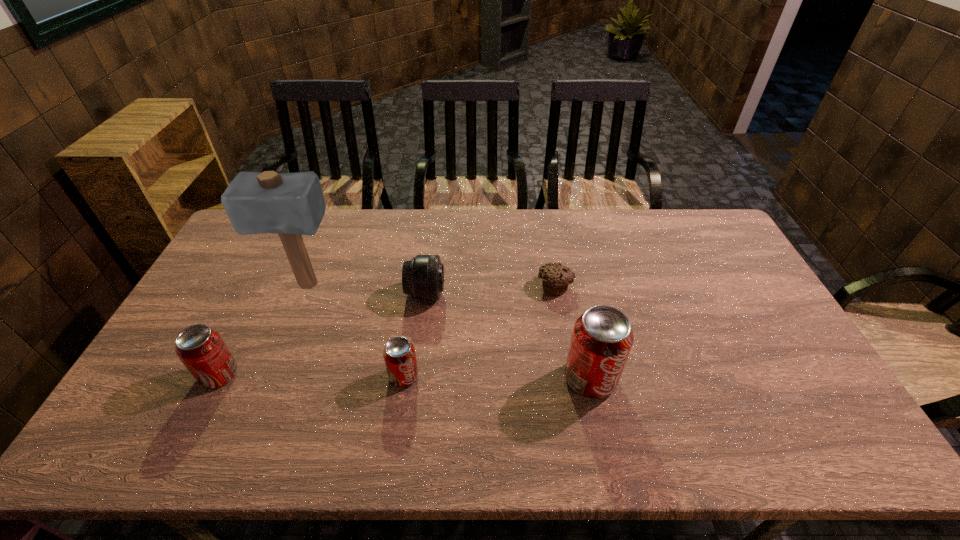
Where is `free region at the near right corner of the desktop`? free region at the near right corner of the desktop is located at coordinates (827, 414).

You are a GUI agent. You are given a task and a screenshot of the screen. Output one action in this format:
    pyautogui.click(x=<x>, y=<y>)
    Task: Click on the unoccupied area between the muffin and the shortest soda can
    The width and height of the screenshot is (960, 540).
    Given the screenshot: What is the action you would take?
    pyautogui.click(x=480, y=331)

Where is `free point between the muffin and the fifth shortest object`? free point between the muffin and the fifth shortest object is located at coordinates (572, 332).

Find the location of a particular element. The image size is (960, 540). blank region between the muffin and the telephoto lens is located at coordinates pyautogui.click(x=491, y=289).

The width and height of the screenshot is (960, 540). In order to click on free space between the telephoto lens and the leftmost soda can in this screenshot , I will do `click(323, 334)`.

The image size is (960, 540). Identify the location of empty space between the leftmost soda can and the tallest object. (263, 330).

Where is `free space that is in between the second soda can from left to right and the rightmost soda can`? This screenshot has width=960, height=540. free space that is in between the second soda can from left to right and the rightmost soda can is located at coordinates (497, 377).

Locate an element on the screen. This screenshot has height=540, width=960. free spot between the second soda can from left to right and the leftmost soda can is located at coordinates point(312,376).

Locate an element on the screen. This screenshot has width=960, height=540. empty space between the second soda can from right to left and the mallet is located at coordinates (355, 331).

What are the coordinates of `empty space that is in between the shortest object and the rightmost soda can` in the screenshot? It's located at (572, 332).